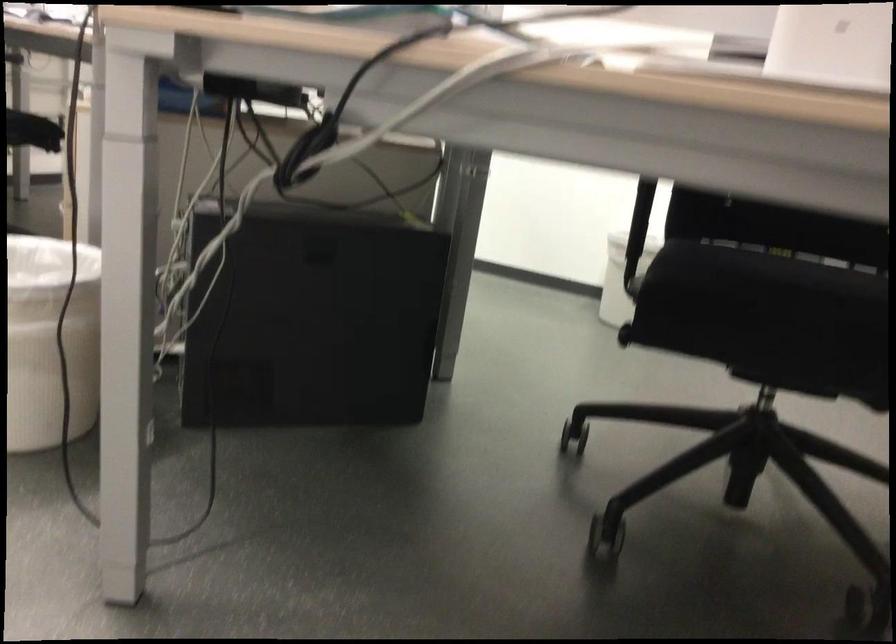
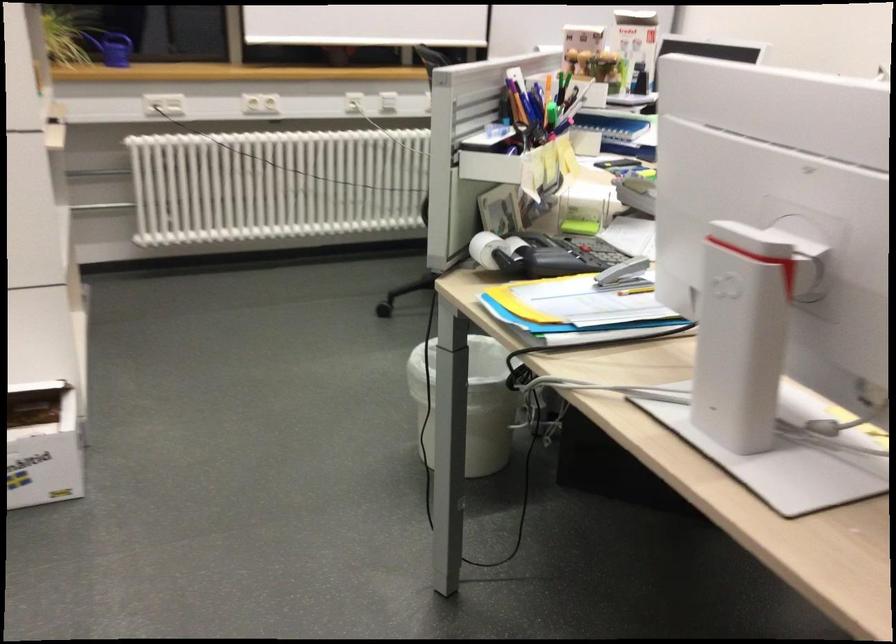
In the second image, find the point that corresponds to [410,491] in the first image.

(662, 574)